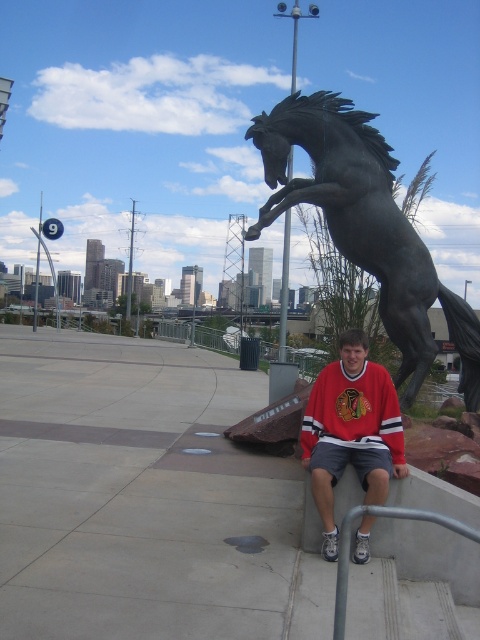
Between bronze horse at upper right and red matte jersey at center, which one appears on the left side from the viewer's perspective?

From the viewer's perspective, red matte jersey at center appears more on the left side.

Is bronze horse at upper right below red matte jersey at center?

Incorrect, bronze horse at upper right is not positioned below red matte jersey at center.

This screenshot has width=480, height=640. I want to click on bronze horse at upper right, so click(x=365, y=227).

Based on the photo, is bronze horse at upper right to the left of gray metallic rail at lower center from the viewer's perspective?

Incorrect, bronze horse at upper right is not on the left side of gray metallic rail at lower center.

Which is above, bronze horse at upper right or gray metallic rail at lower center?

bronze horse at upper right

This screenshot has width=480, height=640. Find the location of `bronze horse at upper right`. bronze horse at upper right is located at coordinates (365, 227).

Is red matte jersey at center positioned before gray metallic rail at lower center?

No, red matte jersey at center is behind gray metallic rail at lower center.

Is red matte jersey at center to the left of gray metallic rail at lower center from the viewer's perspective?

Incorrect, red matte jersey at center is not on the left side of gray metallic rail at lower center.

Is point (376, 435) closer to camera compared to point (339, 556)?

No, (376, 435) is behind (339, 556).

Where is `red matte jersey at center`? The height and width of the screenshot is (640, 480). red matte jersey at center is located at coordinates (350, 432).